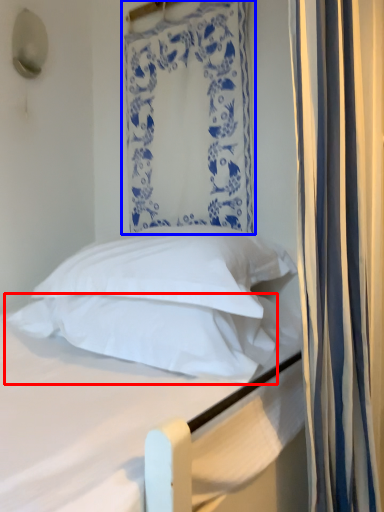
Question: Which object is closer to the camera taking this photo, pillow (highlighted by a red box) or curtain (highlighted by a blue box)?

Choices:
 (A) pillow
 (B) curtain

Answer: (A)